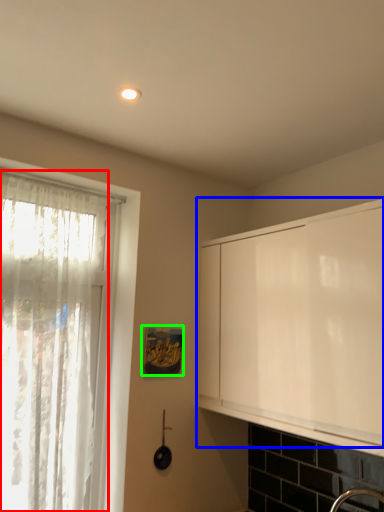
Question: Which object is positioned farthest from curtain (highlighted by a red box)? Select from cabinetry (highlighted by a blue box) and picture frame (highlighted by a green box).

Choices:
 (A) cabinetry
 (B) picture frame

Answer: (A)